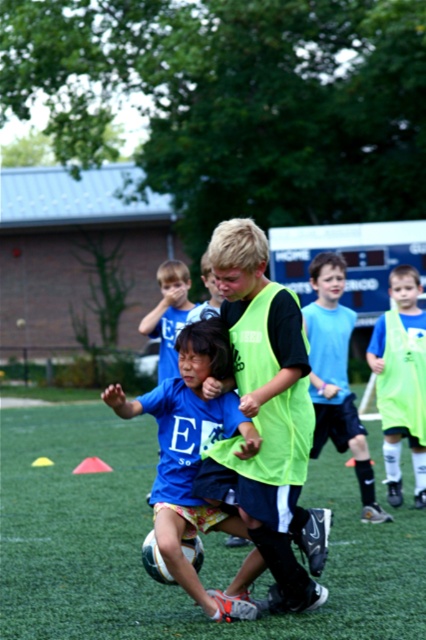
Question: Among these objects, which one is farthest from the camera?

Choices:
 (A) blue fabric shirt at center
 (B) light blue jersey at center
 (C) neon green vest at right
 (D) neon green jersey at center

Answer: (C)

Question: Is neon green jersey at center further to camera compared to light blue jersey at center?

Choices:
 (A) no
 (B) yes

Answer: (A)

Question: Which point appears closest to the camera in this image?

Choices:
 (A) (330, 252)
 (B) (383, 381)

Answer: (B)

Question: From the image, what is the correct spatial relationship of neon green jersey at center in relation to neon green vest at right?

Choices:
 (A) above
 (B) below

Answer: (B)

Question: Does neon green jersey at center appear under light blue jersey at center?

Choices:
 (A) yes
 (B) no

Answer: (A)

Question: Which point is farther from the camera taking this photo?

Choices:
 (A) (261, 451)
 (B) (324, 369)
 (C) (402, 381)

Answer: (C)